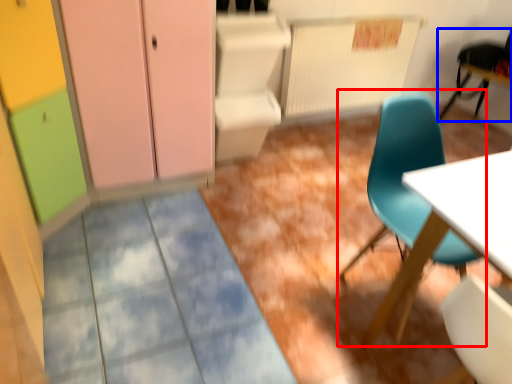
Question: Among these objects, which one is farthest to the camera, chair (highlighted by a red box) or chair (highlighted by a blue box)?

Choices:
 (A) chair
 (B) chair

Answer: (B)